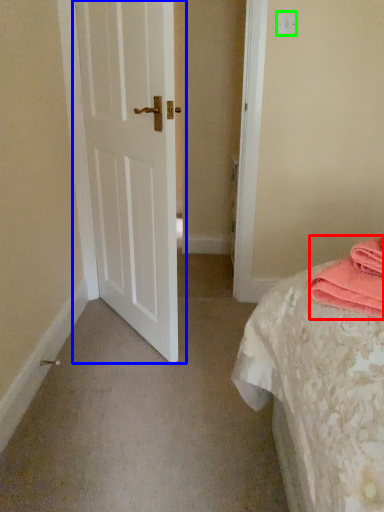
Question: Which object is positioned closest to material (highlighted by a red box)? Select from door (highlighted by a blue box) and light switch (highlighted by a green box).

Choices:
 (A) door
 (B) light switch

Answer: (A)